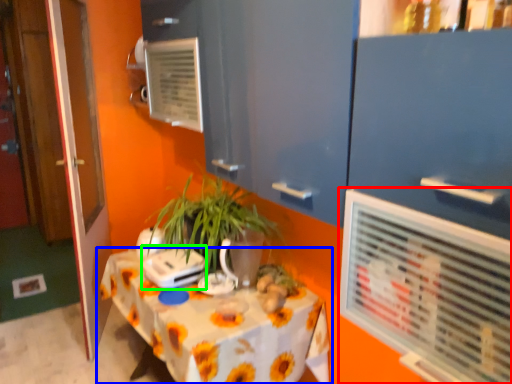
Question: Which object is positioned closest to air conditioning (highlighted by a red box)? Select from table (highlighted by a blue box) and appliance (highlighted by a green box).

Choices:
 (A) table
 (B) appliance

Answer: (A)